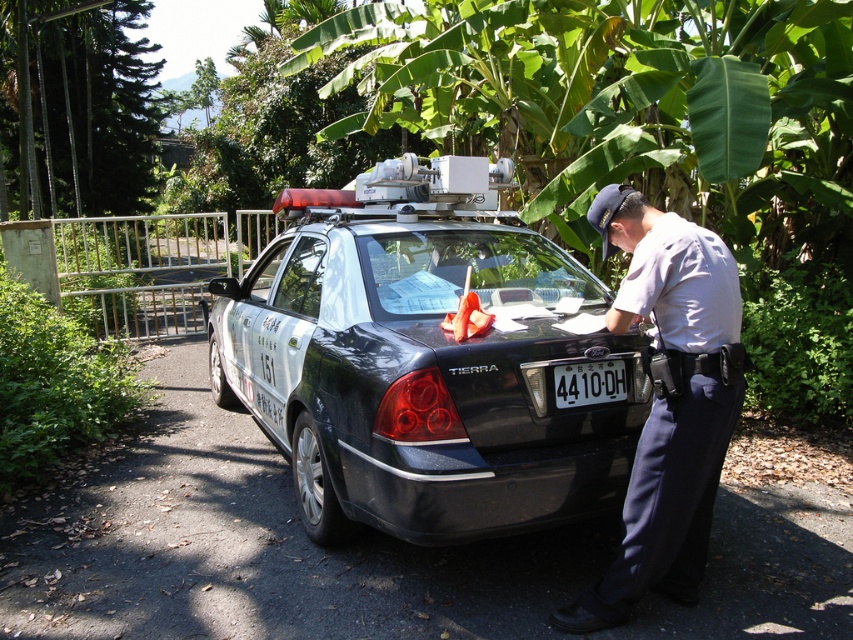
You are a pedestrian standing at the edge of the road where the black glossy police car at center and the green leafy banana tree at upper center are visible. Which object is closer to you?

The black glossy police car at center is closer to you because it is in front of the green leafy banana tree at upper center.

You are a pedestrian standing in front of the parked vehicle. You see the white uniform at center and the white plastic license plate at center. Which one is closer to you?

The white uniform at center is closer to the viewer than the white plastic license plate at center.